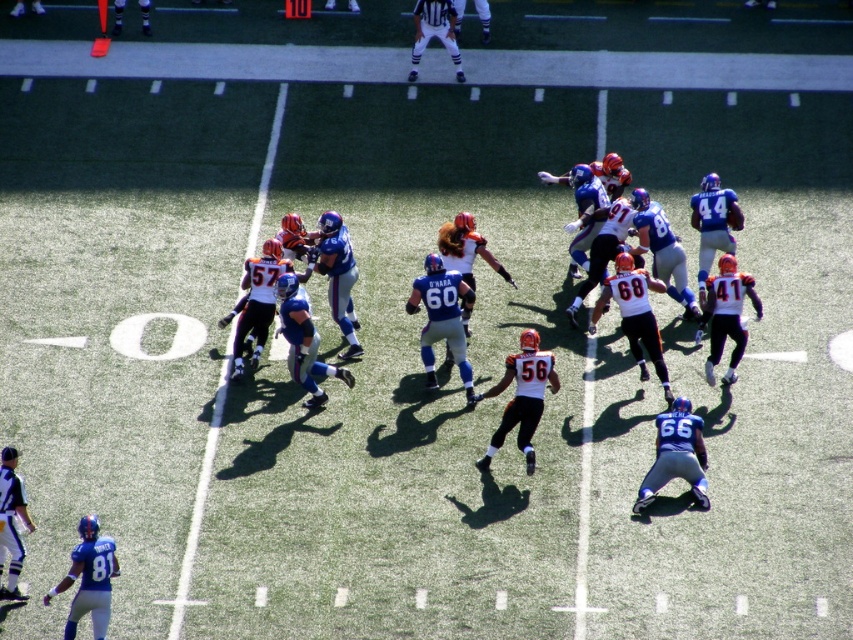
Question: Does blue matte jersey at center have a lesser width compared to white matte jersey at center?

Choices:
 (A) no
 (B) yes

Answer: (B)

Question: Estimate the real-world distances between objects in this image. Which object is closer to the blue matte jersey at lower right?

Choices:
 (A) white jersey at center
 (B) blue matte jersey at lower left

Answer: (A)

Question: Which point is closer to the camera?

Choices:
 (A) (432, 19)
 (B) (641, 484)

Answer: (B)

Question: From the image, what is the correct spatial relationship of blue uniformed player at lower left in relation to white uniform at upper center?

Choices:
 (A) left
 (B) right

Answer: (A)

Question: Based on their relative distances, which object is farther from the white matte jersey at center?

Choices:
 (A) white jersey at center
 (B) blue matte jersey at lower right
 (C) orange jersey at center
 (D) blue uniformed player at lower left

Answer: (D)

Question: Does orange jersey at center have a greater width compared to blue matte jersey at center?

Choices:
 (A) yes
 (B) no

Answer: (A)